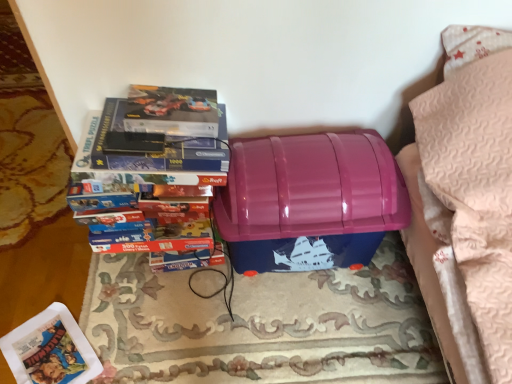
Where is `free space to the back side of matte plastic paperback book at lower left`? free space to the back side of matte plastic paperback book at lower left is located at coordinates (77, 296).